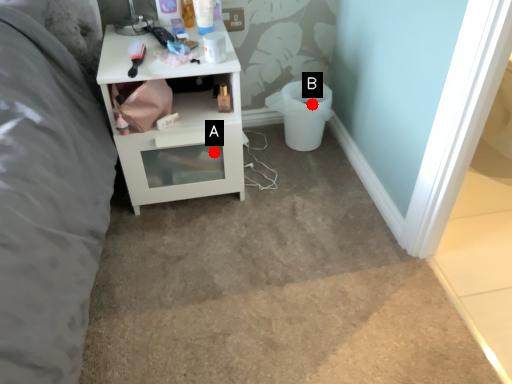
Question: Two points are circled on the image, labeled by A and B beside each circle. Among these points, which one is farthest from the camera?

Choices:
 (A) A is further
 (B) B is further

Answer: (B)